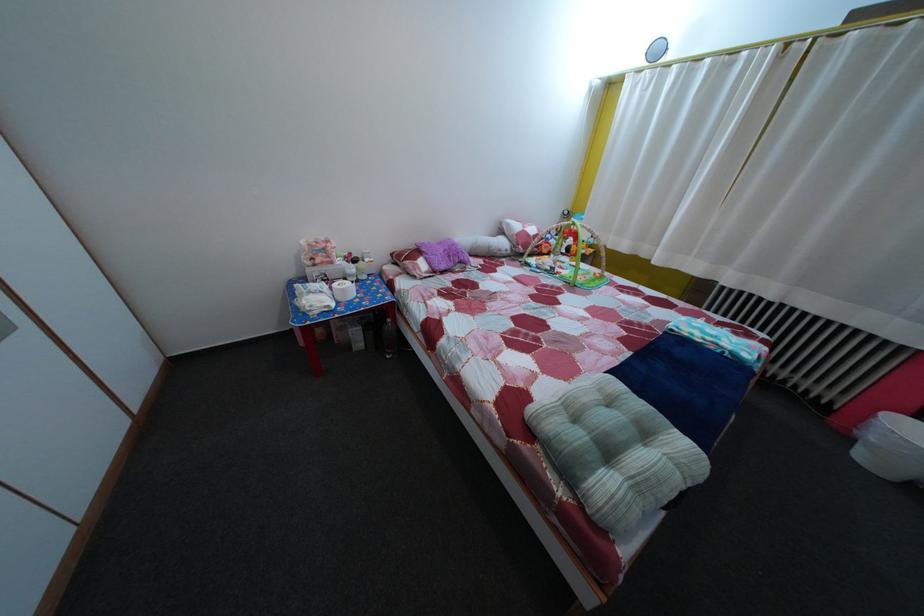
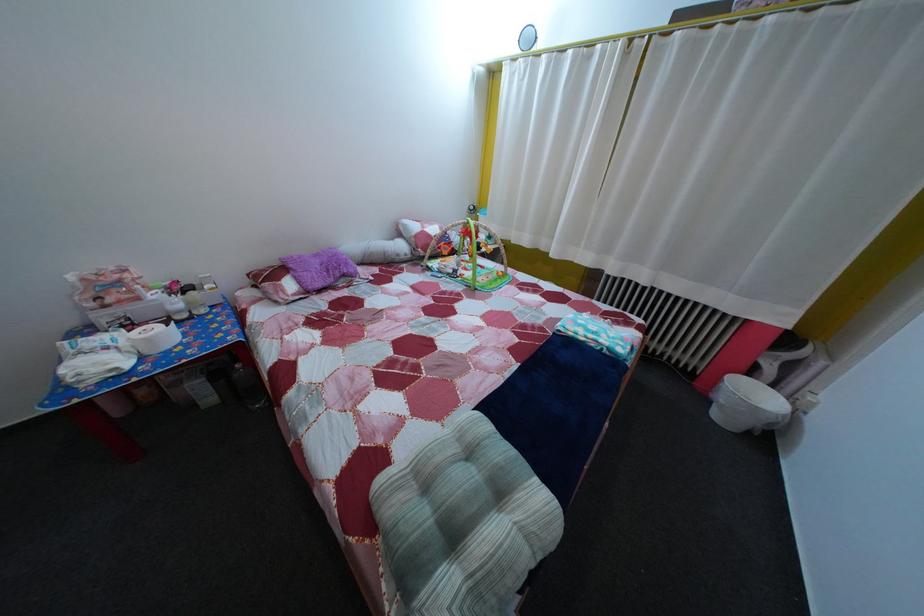
Which direction would the cameraman need to move to produce the second image?

The movement direction of the cameraman is right, forward.